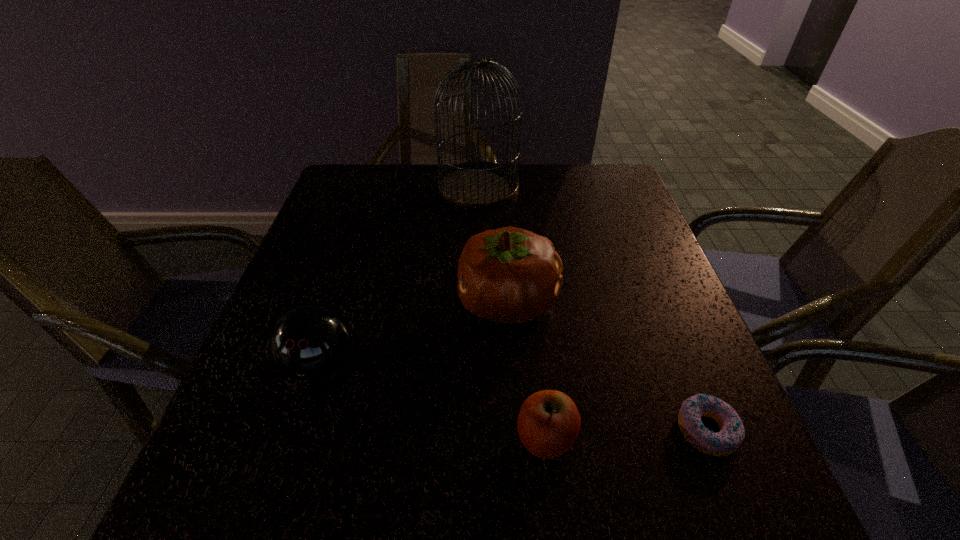
At what (x,y) coordinates should I click in order to perform the action: click on vacant area situated on the side of the second tallest object with the cute face. Please return your answer as a coordinate pair (x, y). The height and width of the screenshot is (540, 960). Looking at the image, I should click on (301, 301).

Locate an element on the screen. vacant space located on the side of the second tallest object with the cute face is located at coordinates (373, 301).

Image resolution: width=960 pixels, height=540 pixels. In order to click on free space located on the surface of the bowling ball near the finger holes in this screenshot , I will do pos(293,453).

Find the location of a particular element. vacant region located on the right of the apple is located at coordinates (688, 438).

Locate an element on the screen. The height and width of the screenshot is (540, 960). free space located on the back of the rightmost object is located at coordinates (654, 298).

Locate an element on the screen. object situated at the far edge is located at coordinates (475, 184).

In order to click on object at the near edge in this screenshot , I will do `click(548, 424)`.

The width and height of the screenshot is (960, 540). I want to click on object positioned at the left edge, so click(309, 342).

Where is `object at the right edge`? This screenshot has width=960, height=540. object at the right edge is located at coordinates (x=729, y=438).

The width and height of the screenshot is (960, 540). What are the coordinates of `free location at the far edge of the desktop` in the screenshot? It's located at (532, 165).